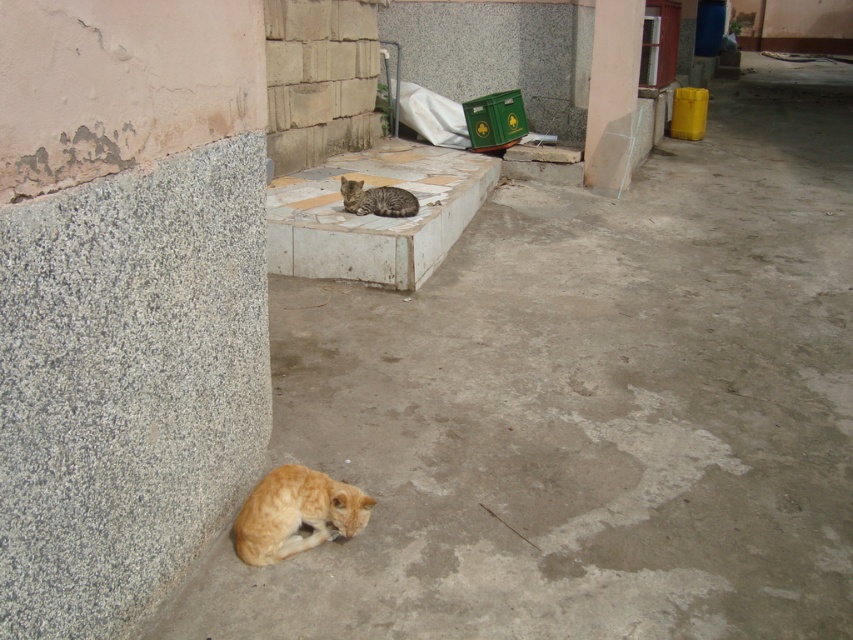
You are a photographer standing at the point marked by the coordinates point (296,513). You want to take a photo of the orange fur cat at lower left. Is there any object between you and the orange fur cat at lower left that might block your view?

The orange fur cat at lower left is located at point (296,513), so there are no objects between you and the orange fur cat at lower left to block your view.

You are a cat owner who wants to ensure both cats can see each other clearly. Given that cats have a visual range of about 10 feet, can the gray stone cat at center and the orange fur cat at lower left see each other within their visual range?

The gray stone cat at center and the orange fur cat at lower left are 8.70 feet apart, which is within their visual range of 10 feet. Therefore, they can see each other clearly.

Looking at this image, you are a cat owner who wants to place a small water bowl between the gray stone cat at center and the gray granite pillar at upper center. The bowl requires 2 feet of space. Is there enough space between them?

The distance between the gray stone cat at center and the gray granite pillar at upper center is 5.17 feet, which is more than the required 2 feet. Therefore, there is enough space to place the water bowl between them.